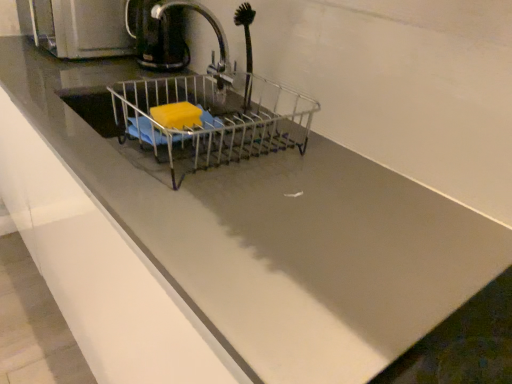
Image resolution: width=512 pixels, height=384 pixels. I want to click on free point in front of metallic wire basket at center, so click(x=231, y=225).